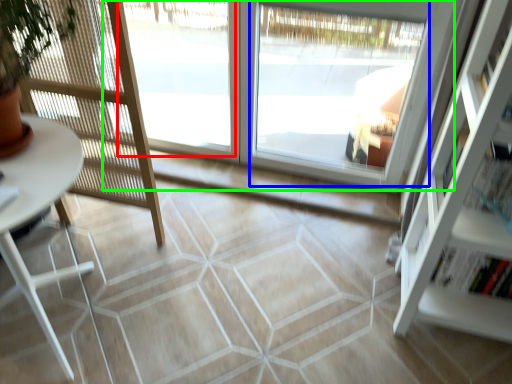
Question: Based on their relative distances, which object is nearer to window (highlighted by a red box)? Choose from window (highlighted by a blue box) and window (highlighted by a green box).

Choices:
 (A) window
 (B) window

Answer: (B)